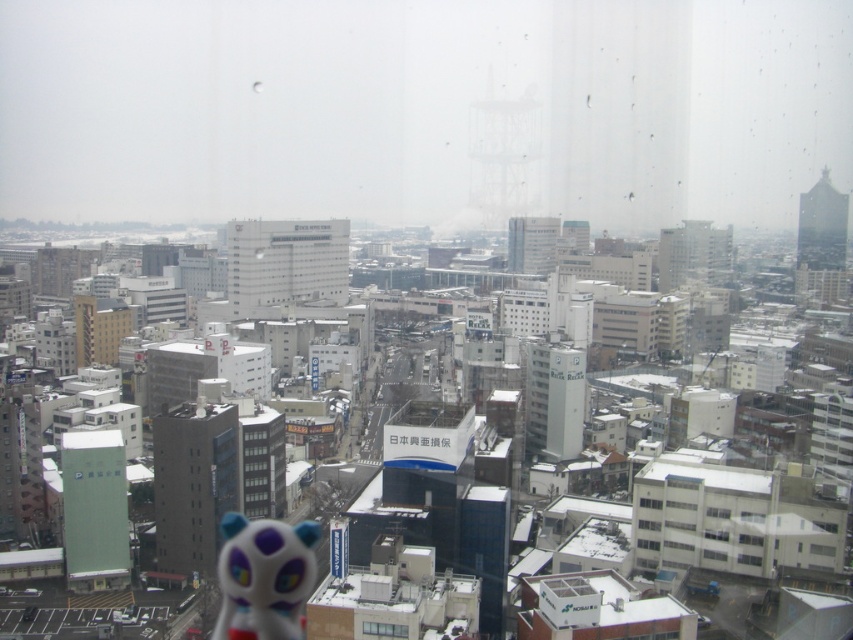
Does white glossy toy at lower center have a larger size compared to transparent glass window at center?

Correct, white glossy toy at lower center is larger in size than transparent glass window at center.

Who is positioned more to the right, white glossy toy at lower center or transparent glass window at center?

transparent glass window at center is more to the right.

Does point (242, 632) come closer to viewer compared to point (379, 628)?

No, it is behind (379, 628).

Where is `white glossy toy at lower center`? white glossy toy at lower center is located at coordinates (264, 577).